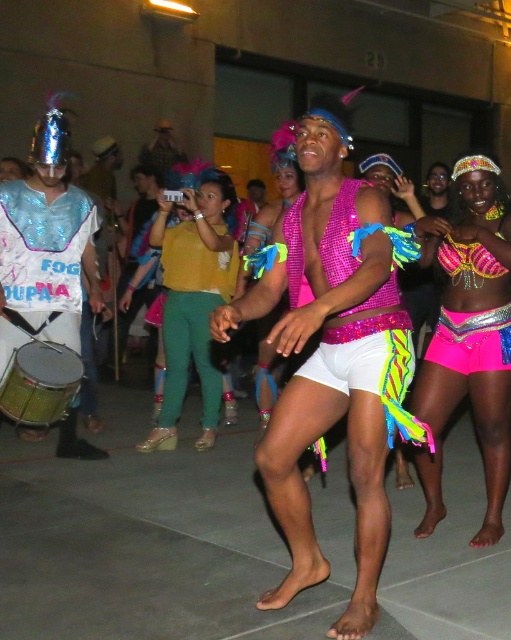
Question: Which of the following is the farthest from the observer?

Choices:
 (A) neon pink sequined shorts at center
 (B) glittery sequined vest at left
 (C) gold metallic drum at lower left

Answer: (B)

Question: Which point is closer to the camera?

Choices:
 (A) pink sequined top at center
 (B) neon pink sequined shorts at center

Answer: (A)

Question: Is neon pink sequined shorts at center above glittery sequined vest at left?

Choices:
 (A) no
 (B) yes

Answer: (A)

Question: Which point is farther to the camera?

Choices:
 (A) gold metallic drum at lower left
 (B) pink sequined top at center
 (C) matte yellow shirt at center

Answer: (C)

Question: Is the position of matte yellow shirt at center more distant than that of gold metallic drum at lower left?

Choices:
 (A) yes
 (B) no

Answer: (A)

Question: From the image, what is the correct spatial relationship of neon pink sequined shorts at center in relation to gold metallic drum at lower left?

Choices:
 (A) below
 (B) above

Answer: (B)